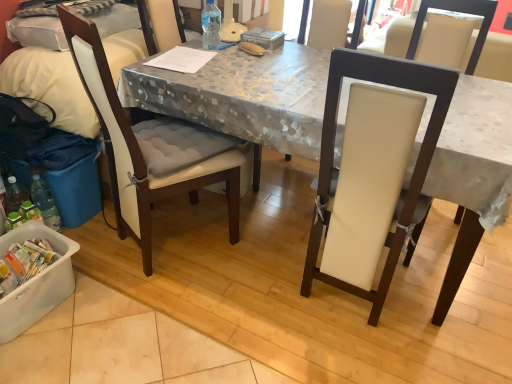
The height and width of the screenshot is (384, 512). In order to click on empty space that is in between white leather chair at center, which appears as the second chair when viewed from the left, and white fabric-covered desk at center in this screenshot , I will do `click(311, 306)`.